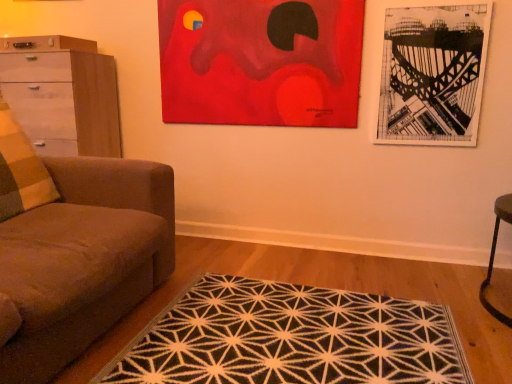
The width and height of the screenshot is (512, 384). I want to click on free point below black geometric rug at center (from a real-world perspective), so click(x=352, y=342).